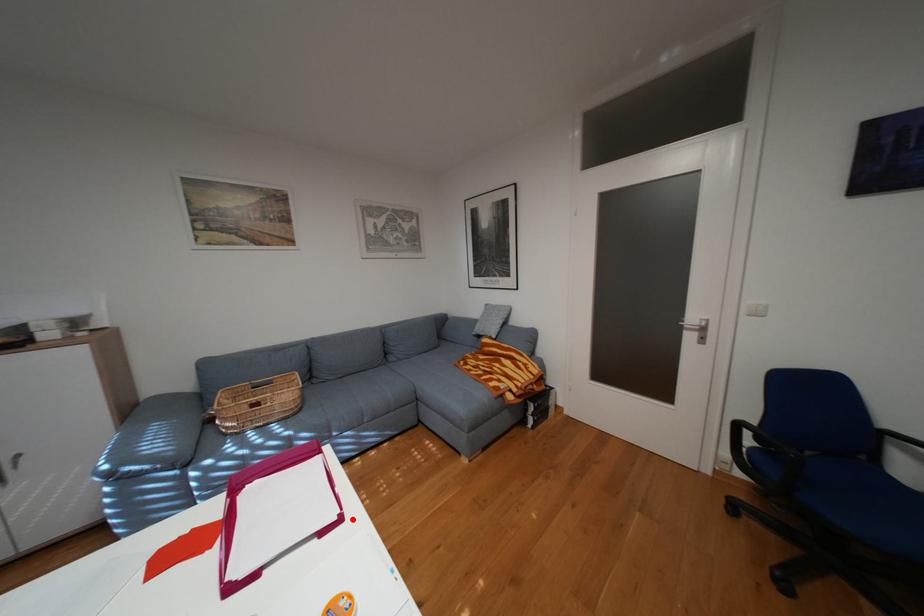
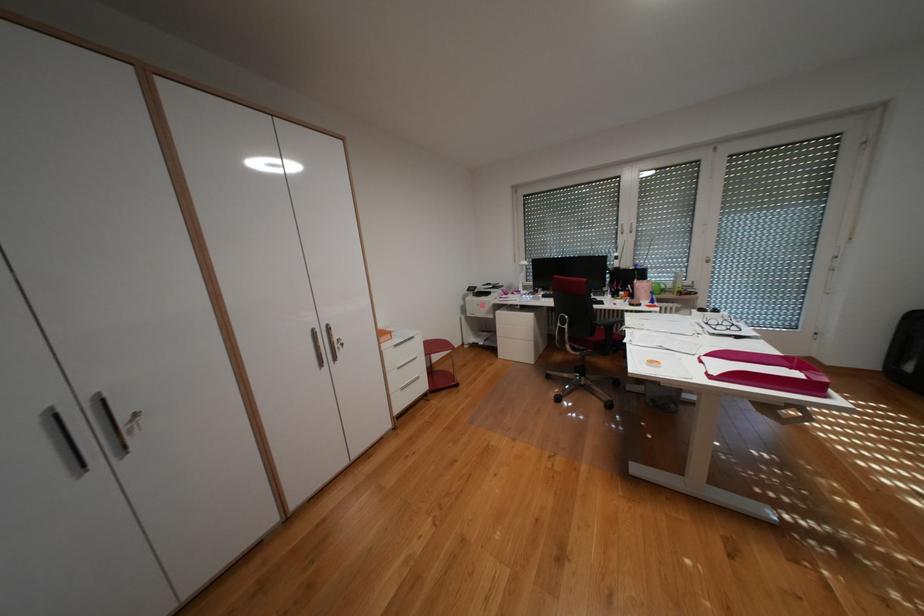
In the second image, find the point that corresponds to the highlighted location in the first image.

(723, 377)